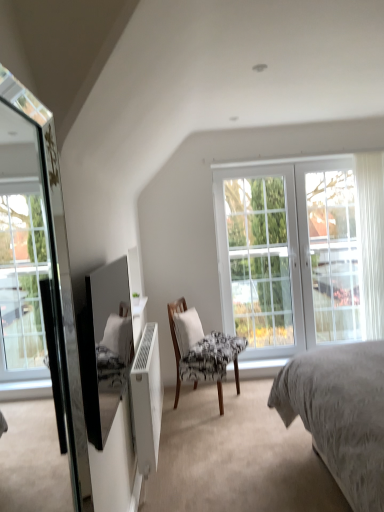
Question: Is white glass screen door at right wider or thinner than white fabric pillow at center?

Choices:
 (A) wide
 (B) thin

Answer: (B)

Question: From the image's perspective, is white glass screen door at right above or below white fabric pillow at center?

Choices:
 (A) above
 (B) below

Answer: (A)

Question: Which object is the farthest from the black glossy mirror at left, positioned as the second mirror in front-to-back order?

Choices:
 (A) white glass window at center, positioned as the second window in right-to-left order
 (B) white glass screen door at right
 (C) white matte radiator at lower left
 (D) white fabric pillow at center
 (E) wooden chair with patterned fabric at center

Answer: (B)

Question: Which object is positioned farthest from the black glossy mirror at left, the 1th mirror positioned from the back?

Choices:
 (A) white fabric pillow at center
 (B) white sheer curtain at right
 (C) wooden chair with patterned fabric at center
 (D) white glass window at center, the first window when ordered from right to left
 (E) white glass screen door at right

Answer: (B)